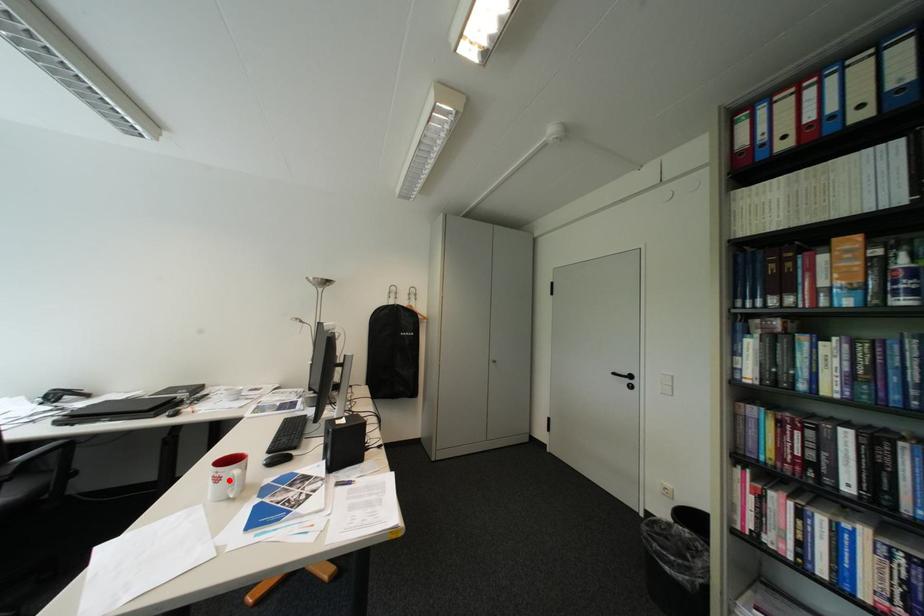
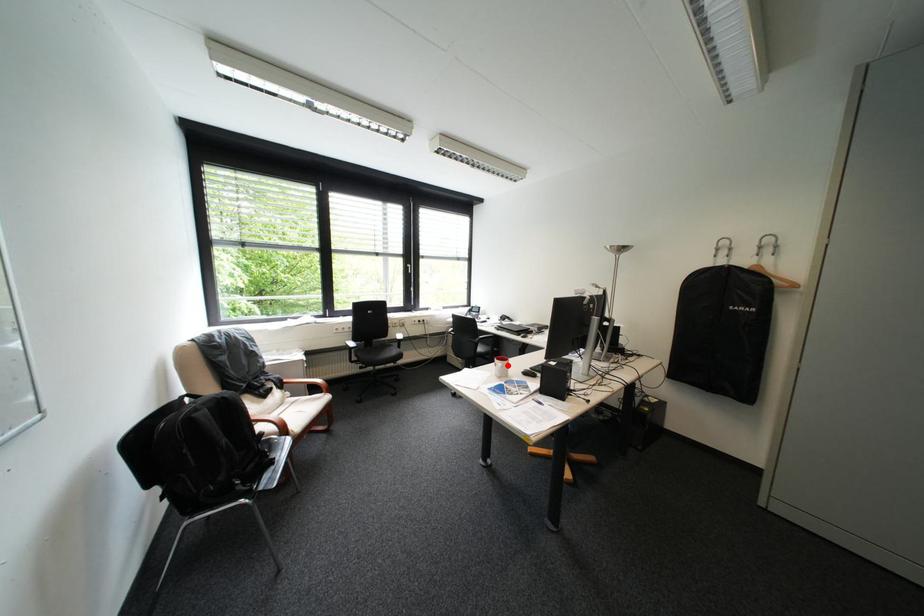
I am providing you with two images of the same scene from different viewpoints. A red point is marked on the first image and another point is marked on the second image. Is the red point in image1 aligned with the point shown in image2?

Yes